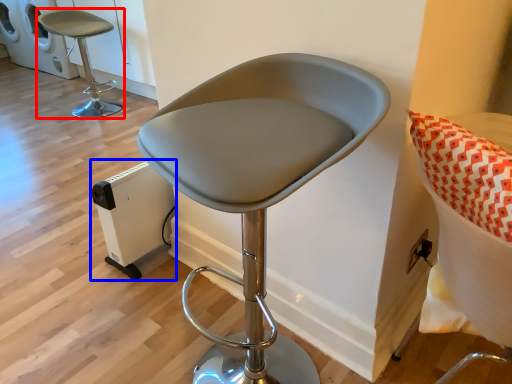
Question: Which object is closer to the camera taking this photo, chair (highlighted by a red box) or appliance (highlighted by a blue box)?

Choices:
 (A) chair
 (B) appliance

Answer: (B)